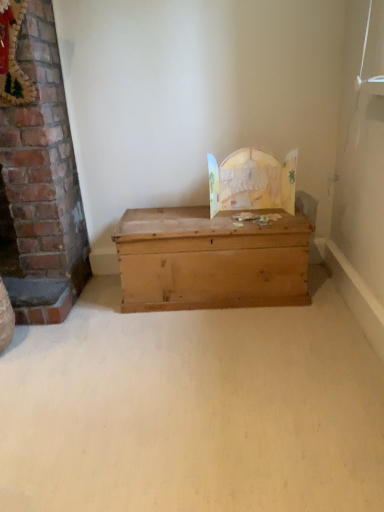
Question: Is brick fireplace at left shorter than natural wood trunk at center?

Choices:
 (A) no
 (B) yes

Answer: (A)

Question: Is the position of brick fireplace at left more distant than that of natural wood trunk at center?

Choices:
 (A) no
 (B) yes

Answer: (A)

Question: Is brick fireplace at left oriented towards natural wood trunk at center?

Choices:
 (A) yes
 (B) no

Answer: (A)

Question: Is brick fireplace at left facing away from natural wood trunk at center?

Choices:
 (A) no
 (B) yes

Answer: (A)

Question: Is brick fireplace at left outside of natural wood trunk at center?

Choices:
 (A) yes
 (B) no

Answer: (A)

Question: Is brick fireplace at left to the right of natural wood trunk at center from the viewer's perspective?

Choices:
 (A) no
 (B) yes

Answer: (A)

Question: Is natural wood trunk at center at the right side of brick fireplace at left?

Choices:
 (A) yes
 (B) no

Answer: (A)

Question: Is natural wood trunk at center positioned far away from brick fireplace at left?

Choices:
 (A) yes
 (B) no

Answer: (B)

Question: Is natural wood trunk at center beside brick fireplace at left?

Choices:
 (A) no
 (B) yes

Answer: (A)

Question: From a real-world perspective, is natural wood trunk at center beneath brick fireplace at left?

Choices:
 (A) no
 (B) yes

Answer: (B)

Question: Is natural wood trunk at center located outside brick fireplace at left?

Choices:
 (A) yes
 (B) no

Answer: (A)

Question: Is natural wood trunk at center further to the viewer compared to brick fireplace at left?

Choices:
 (A) no
 (B) yes

Answer: (B)

Question: Is natural wood trunk at center wider or thinner than brick fireplace at left?

Choices:
 (A) wide
 (B) thin

Answer: (A)